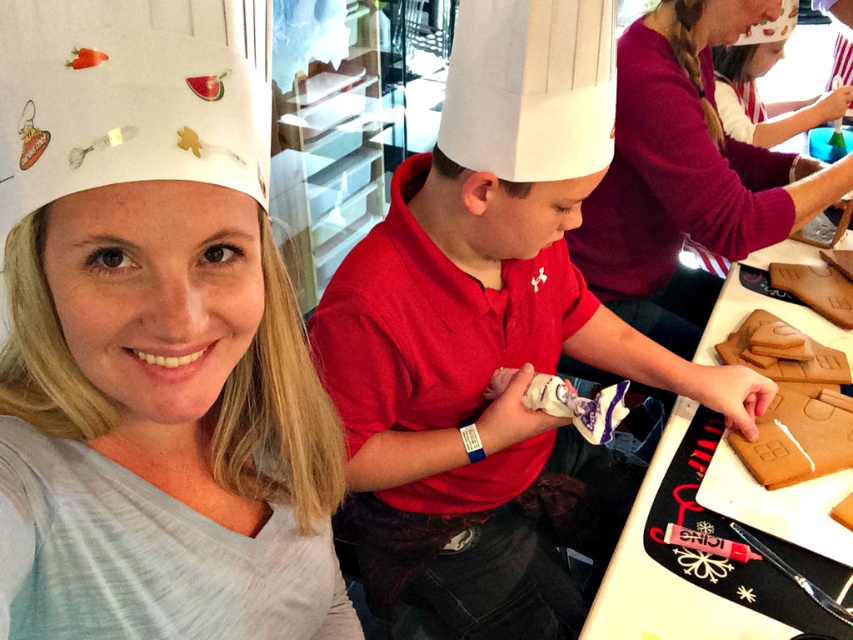
Question: Is white frosted gingerbread house at center thinner than brown matte gingerbread house at center?

Choices:
 (A) no
 (B) yes

Answer: (A)

Question: Which of the following is the closest to the observer?

Choices:
 (A) white frosted gingerbread house at center
 (B) matte white chef hat at center
 (C) brown matte gingerbread house at right
 (D) matte white chef hat at upper left

Answer: (D)

Question: Which object is the farthest from the matte white chef hat at center?

Choices:
 (A) matte white chef hat at upper left
 (B) white frosted gingerbread house at center
 (C) brown matte gingerbread house at right

Answer: (C)

Question: Can you confirm if white frosted gingerbread house at center is positioned below brown matte gingerbread house at right?

Choices:
 (A) yes
 (B) no

Answer: (A)

Question: Can you confirm if matte white chef hat at upper left is bigger than white frosted gingerbread house at center?

Choices:
 (A) yes
 (B) no

Answer: (A)

Question: Estimate the real-world distances between objects in this image. Which object is farther from the matte white chef hat at center?

Choices:
 (A) brown matte gingerbread house at center
 (B) brown matte gingerbread house at right

Answer: (A)